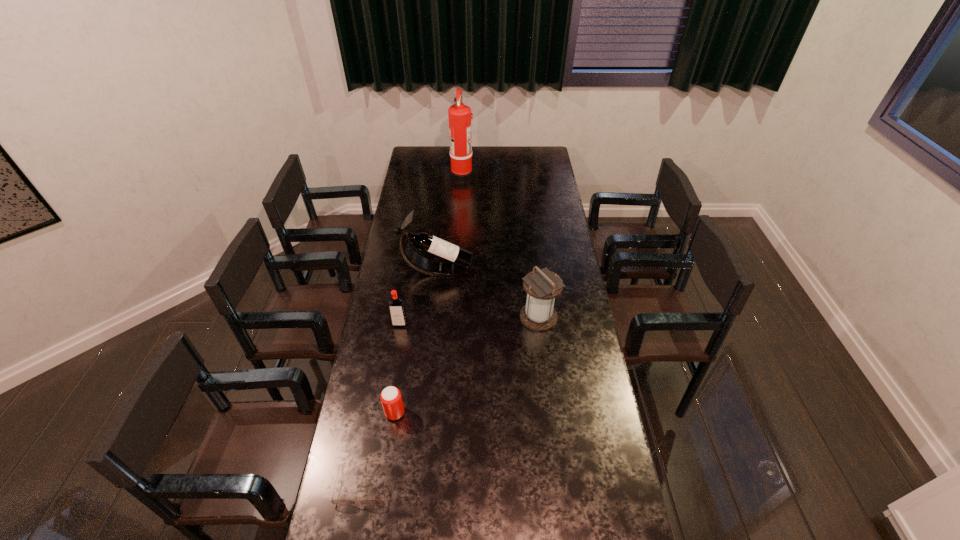
Locate an element on the screen. The width and height of the screenshot is (960, 540). the nearest object is located at coordinates (339, 501).

At what (x,y) coordinates should I click in order to perform the action: click on free space located at the nozzle of the tallest object. Please return your answer as a coordinate pair (x, y). The width and height of the screenshot is (960, 540). Looking at the image, I should click on (484, 176).

Where is `free location located 0.190m on the stand of the wine bottle`? free location located 0.190m on the stand of the wine bottle is located at coordinates (515, 270).

This screenshot has width=960, height=540. In order to click on vacant space situated on the right of the rightmost object in this screenshot , I will do pos(572,317).

Locate an element on the screen. This screenshot has width=960, height=540. vacant region located on the front and back of the vodka is located at coordinates (392, 372).

Where is `vacant area situated 0.090m on the right of the second shortest object`? Image resolution: width=960 pixels, height=540 pixels. vacant area situated 0.090m on the right of the second shortest object is located at coordinates (431, 413).

The height and width of the screenshot is (540, 960). In order to click on vacant area situated on the face of the sunglasses in this screenshot , I will do pyautogui.click(x=353, y=535).

This screenshot has width=960, height=540. I want to click on object present at the far edge, so click(x=461, y=171).

Where is `wine bottle located at the left edge`? wine bottle located at the left edge is located at coordinates (453, 255).

This screenshot has width=960, height=540. In order to click on vodka positioned at the left edge in this screenshot , I will do `click(396, 305)`.